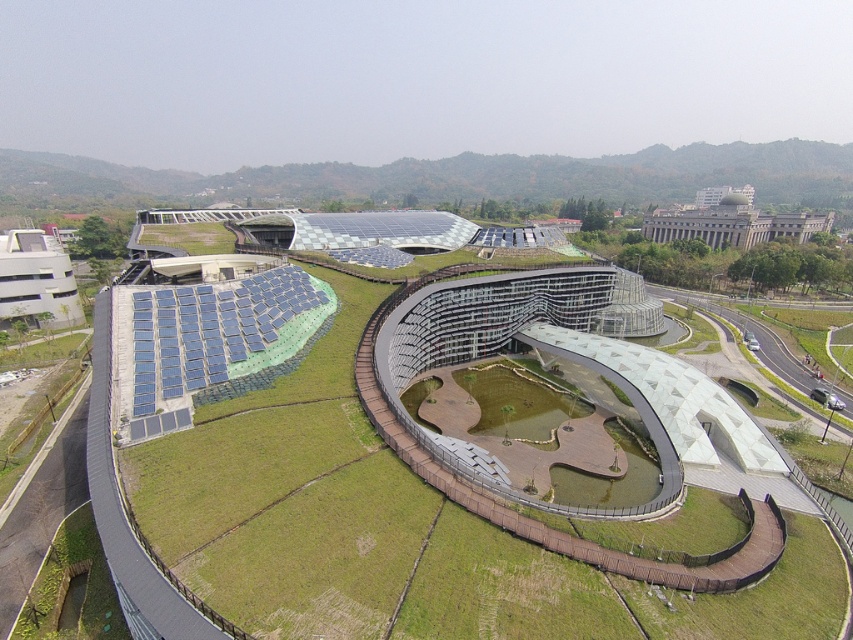
You are a landscape architect evaluating a proposed design for a solar panel installation. The design includes a green grassy hillside at upper center and a gray concrete building at upper right. To ensure proper sunlight access for the solar panels, you need to know which area is wider. Which one has a greater width?

The green grassy hillside at upper center has a greater width than the gray concrete building at upper right according to the description.

You are a drone operator tasked with delivering a package to the gray concrete building at upper right. From your current position above the green grassy hillside at upper center, which direction should you fly to reach the building?

Since the green grassy hillside at upper center is above the gray concrete building at upper right, you should fly downward towards the gray concrete building at upper right to reach it.

You are standing at the entrance of the architectural complex and want to reach the green grassy hillside at upper center. Based on its coordinates, in which general direction should you walk from your current position?

The green grassy hillside at upper center is located at coordinates approximately 0.280 on the x and 0.529 on the y. Since you are at the entrance, which is typically at the lower part of the structure, you should walk upward and slightly to the left to reach the green grassy hillside at upper center.